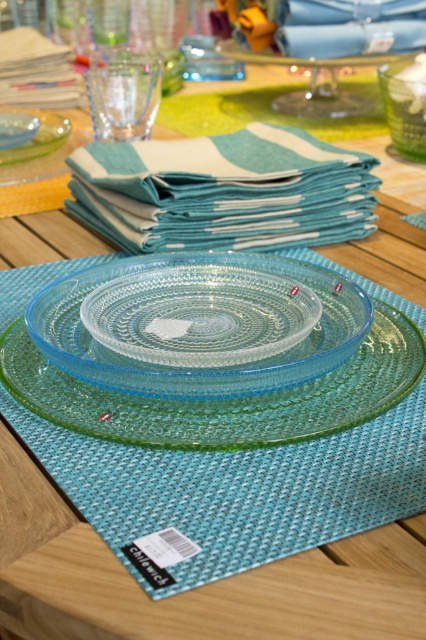
You are holding a small toy that is 3 inches tall. You want to place it on the table so that it doesn not fall off. Considering the point at coordinates point (169, 317), which is 10.55 inches away from your current position, can you safely place the toy there without it falling off the edge?

The point at coordinates point (169, 317) is 10.55 inches away from your current position. Since the toy is only 3 inches tall, placing it there would not cause it to fall off the edge as the distance is sufficient.

You are setting up a table and need to place a centerpiece between the teal woven cloth at upper center and the green textured glass bowl at upper right. Which object should the centerpiece be placed closer to to ensure it is in the foreground?

The teal woven cloth at upper center is closer to the viewer, so the centerpiece should be placed closer to it to remain in the foreground.

You are looking at the table setting and need to place a small decoration. There are two points marked on the table, point (129, 404) and point (25, 145). Which point is closer to you?

Point (129, 404) is closer to the camera than point (25, 145), so it is the closer point.